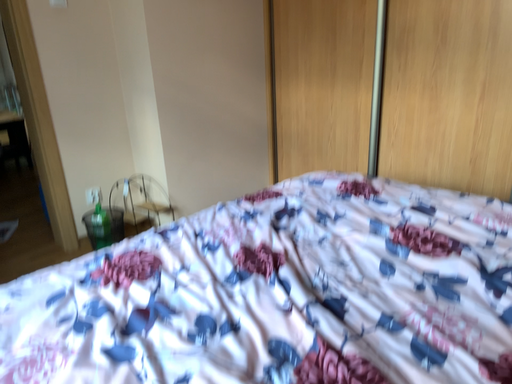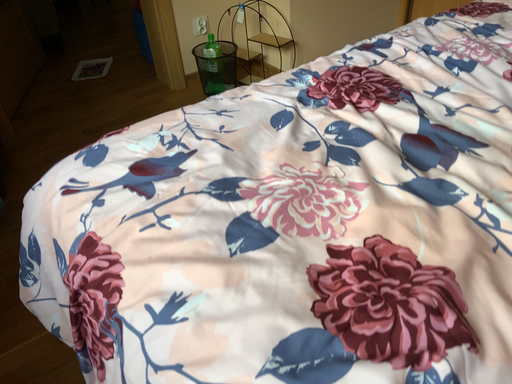
Question: Which way did the camera rotate in the video?

Choices:
 (A) rotated right
 (B) rotated left

Answer: (B)